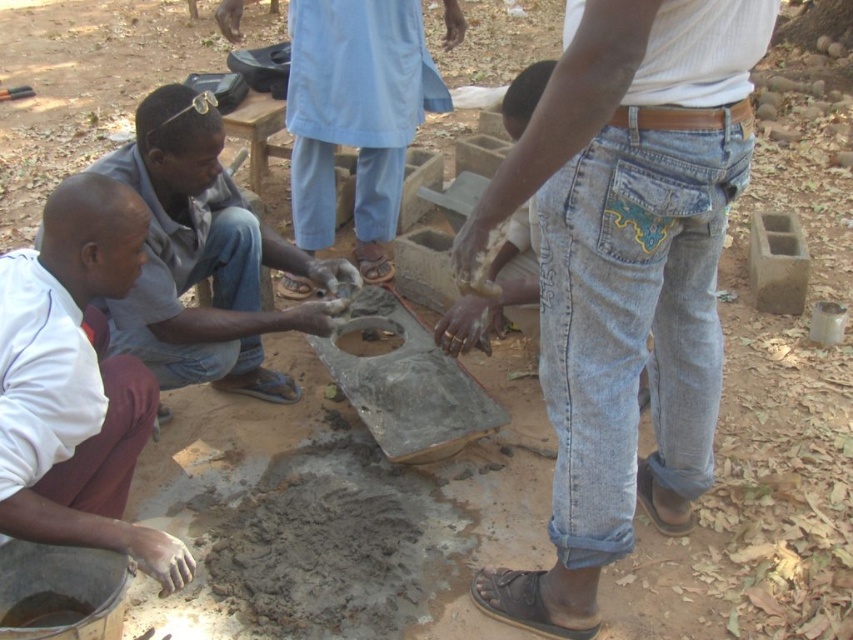
Question: Can you confirm if white fabric shirt at lower left is positioned below matte gray concrete at center?

Choices:
 (A) yes
 (B) no

Answer: (A)

Question: Can you confirm if denim jeans at center is smaller than blue denim jeans at center?

Choices:
 (A) no
 (B) yes

Answer: (A)

Question: Estimate the real-world distances between objects in this image. Which object is farther from the blue denim jeans at center?

Choices:
 (A) white fabric shirt at lower left
 (B) matte gray concrete at center
 (C) denim jeans at center

Answer: (A)

Question: Which point is closer to the camera?

Choices:
 (A) white fabric shirt at lower left
 (B) matte gray concrete at center
 (C) blue denim jeans at center

Answer: (A)

Question: Does denim jeans at center appear on the right side of blue denim jeans at center?

Choices:
 (A) no
 (B) yes

Answer: (B)

Question: Estimate the real-world distances between objects in this image. Which object is closer to the blue denim jeans at center?

Choices:
 (A) denim jeans at center
 (B) white fabric shirt at lower left
 (C) matte gray concrete at center

Answer: (A)